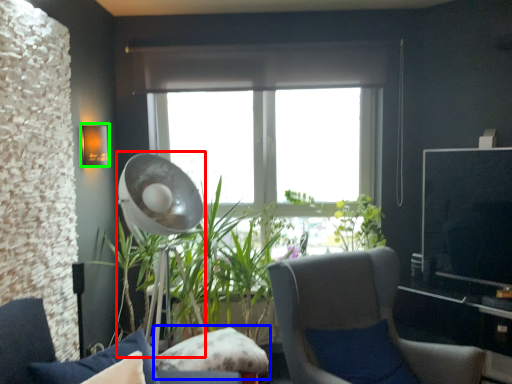
Question: Which object is positioned closest to mechanical fan (highlighted by a red box)? Select from pillow (highlighted by a blue box) and lamp (highlighted by a green box).

Choices:
 (A) pillow
 (B) lamp

Answer: (B)